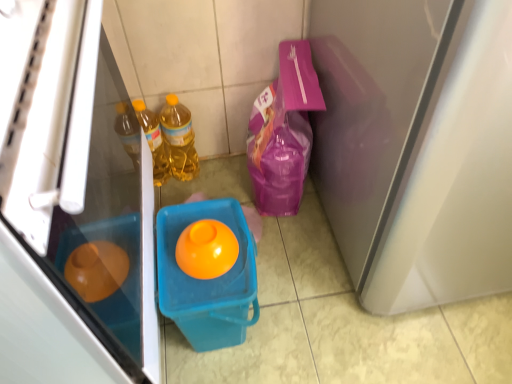
Where is `unoccupied region to the right of translucent yellow bottle at center, acting as the first bottle starting from the right`? unoccupied region to the right of translucent yellow bottle at center, acting as the first bottle starting from the right is located at coordinates (226, 175).